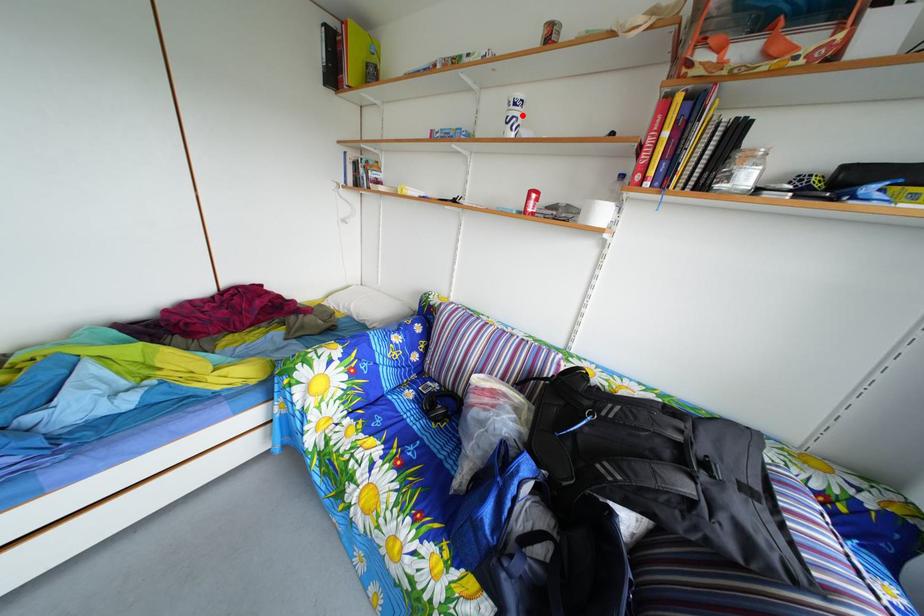
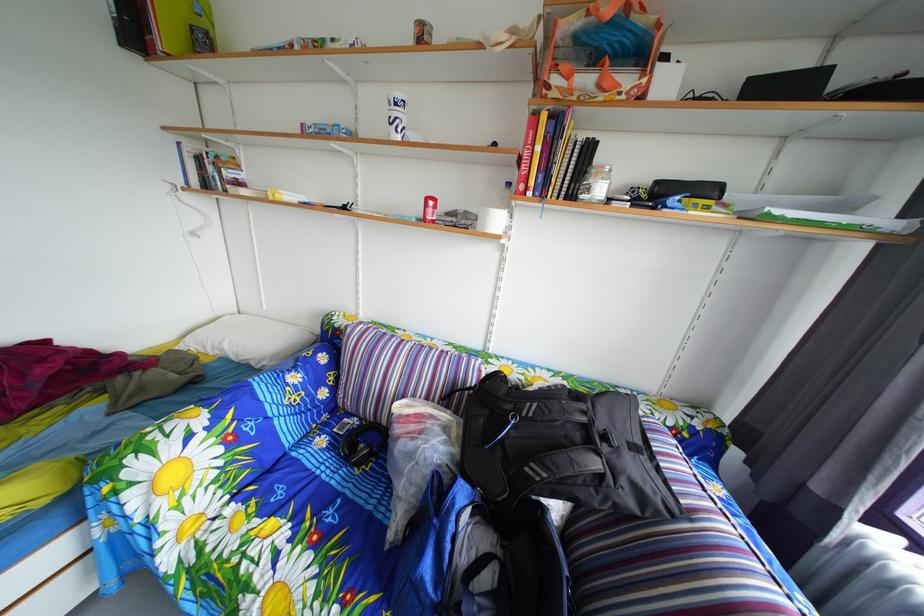
Find the pixel in the second image that matches the highlighted location in the first image.

(404, 116)